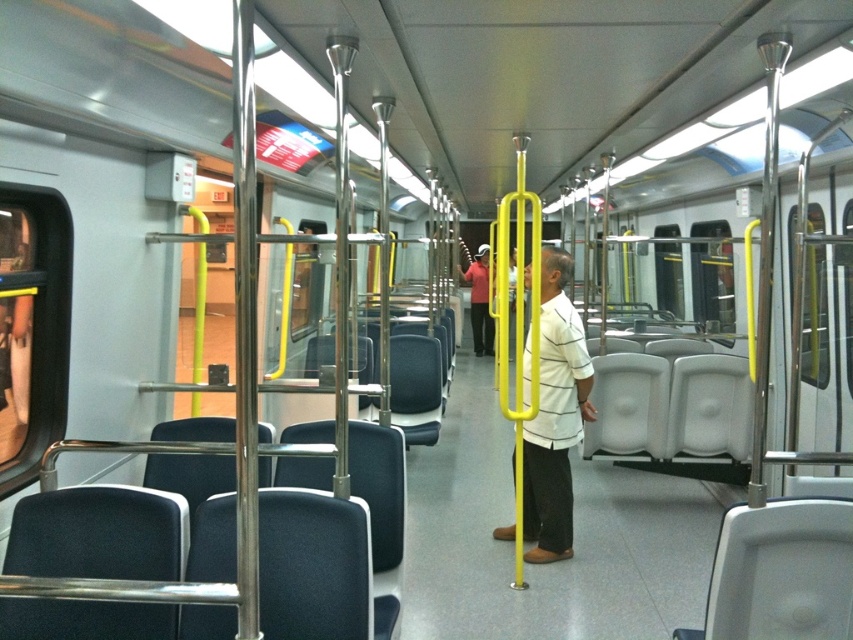
Question: Can you confirm if white striped shirt at center is wider than matte red shirt at center?

Choices:
 (A) yes
 (B) no

Answer: (A)

Question: Can you confirm if white striped shirt at center is positioned to the right of matte red shirt at center?

Choices:
 (A) yes
 (B) no

Answer: (B)

Question: Which point is closer to the camera?

Choices:
 (A) (488, 321)
 (B) (543, 385)

Answer: (B)

Question: Which of the following is the closest to the observer?

Choices:
 (A) (538, 348)
 (B) (486, 252)

Answer: (A)

Question: Among these points, which one is farthest from the camera?

Choices:
 (A) (477, 298)
 (B) (537, 433)

Answer: (A)

Question: Does white striped shirt at center lie behind matte red shirt at center?

Choices:
 (A) no
 (B) yes

Answer: (A)